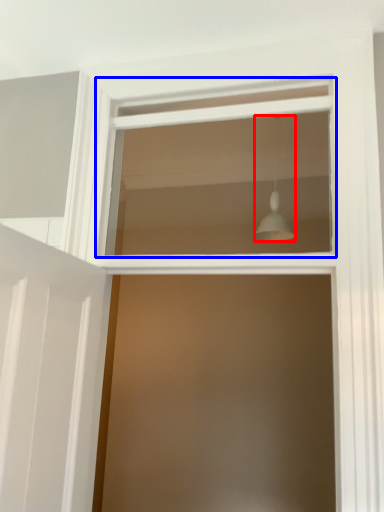
Question: Which object is closer to the camera taking this photo, light fixture (highlighted by a red box) or window (highlighted by a blue box)?

Choices:
 (A) light fixture
 (B) window

Answer: (B)